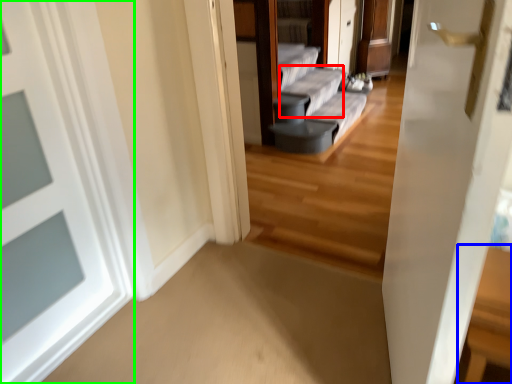
Question: Based on their relative distances, which object is nearer to couch (highlighted by a red box)? Choose from table (highlighted by a blue box) and door (highlighted by a green box).

Choices:
 (A) table
 (B) door

Answer: (B)